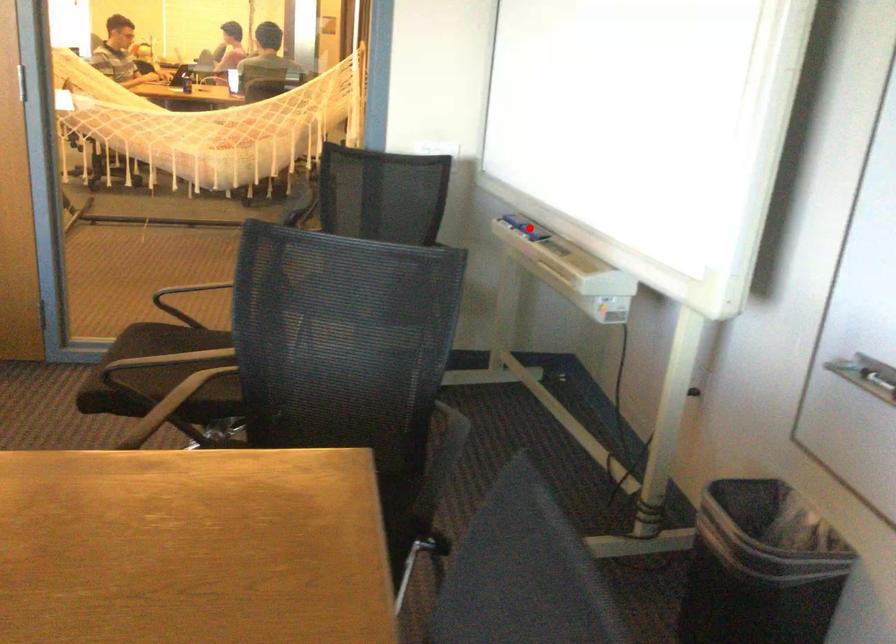
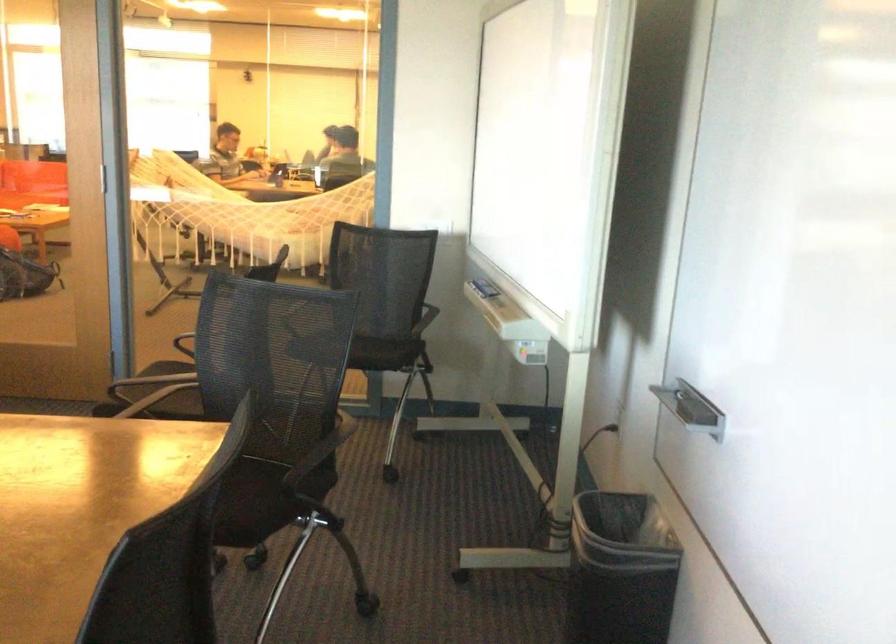
Question: I am providing you with two images of the same scene from different viewpoints. A red point is marked on the first image. Can you still see the location of the red point in image 2?

Choices:
 (A) Yes
 (B) No

Answer: (A)